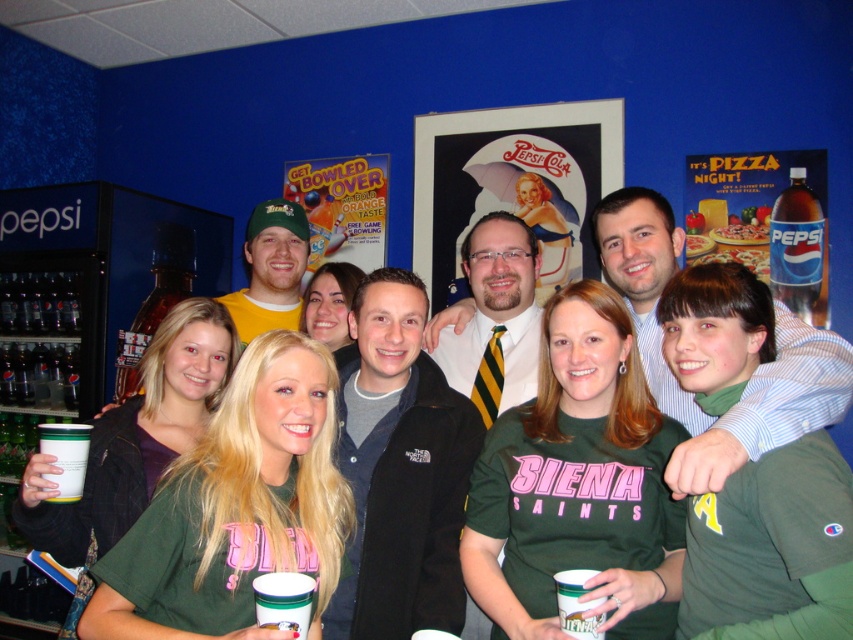
You are at a casual gathering at a bowling alley. You see a black fleece jacket at center and a matte green cap at center. Which one is positioned to the right of the other?

The black fleece jacket at center is to the right of the matte green cap at center.

You are standing at the entrance of the bowling alley and want to find the black fleece jacket at center. According to the coordinates provided, where should you look relative to the image frame?

The black fleece jacket at center is located at coordinates point 0.734 on the x axis and 0.469 on the y axis within the image frame.